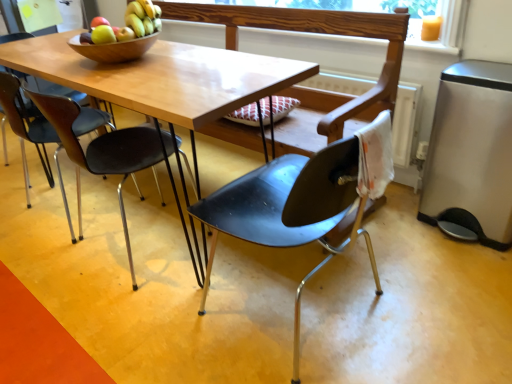
Locate an element on the screen. vacant space in front of stainless steel trash can at right is located at coordinates (470, 267).